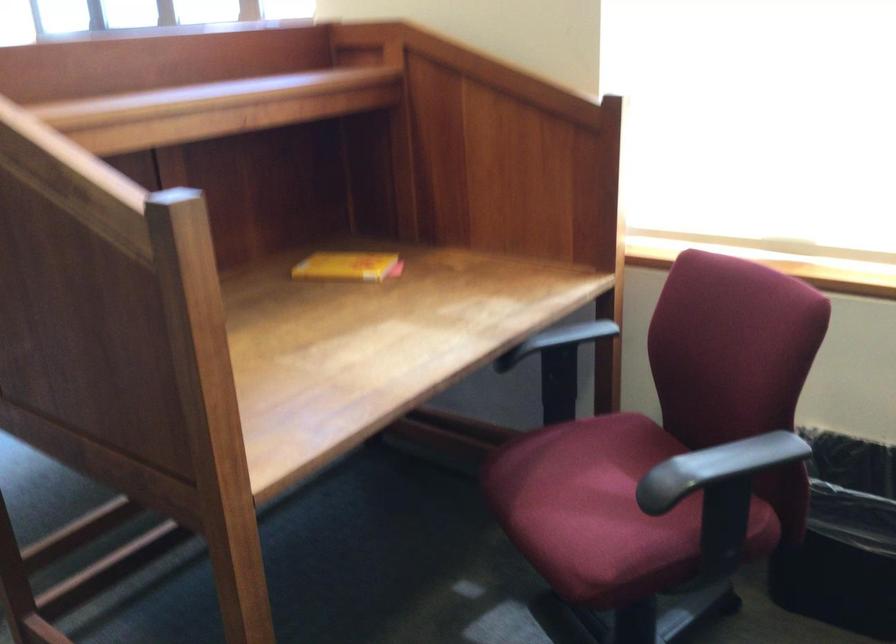
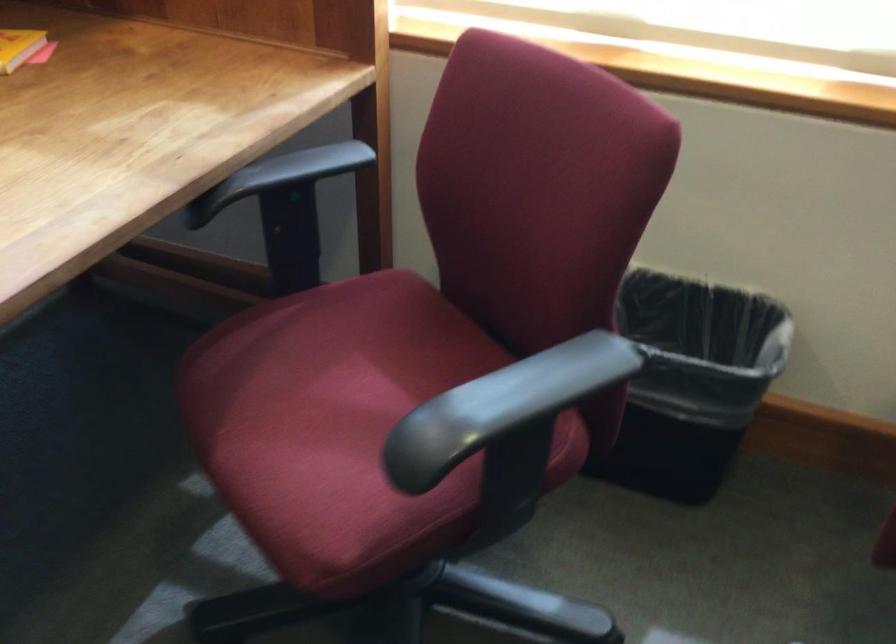
Question: How did the camera likely rotate?

Choices:
 (A) Left
 (B) Right
 (C) Up
 (D) Down

Answer: (D)